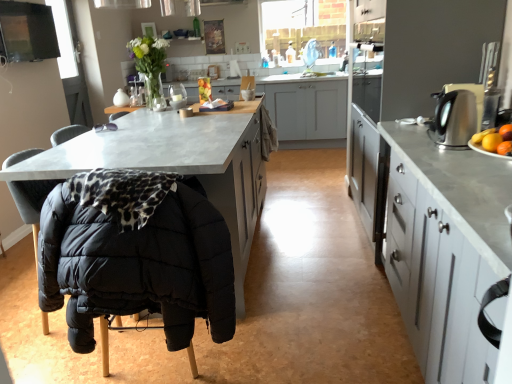
What do you see at coordinates (178, 163) in the screenshot? I see `matte gray cabinet at center, arranged as the second cabinetry when viewed from the front` at bounding box center [178, 163].

You are a GUI agent. You are given a task and a screenshot of the screen. Output one action in this format:
    pyautogui.click(x=<x>, y=<y>)
    Task: Click on the concrete countertop at center, marked as the first cabinetry in a back-to-front arrangement
    This screenshot has width=512, height=384.
    Given the screenshot: What is the action you would take?
    pyautogui.click(x=308, y=111)

The width and height of the screenshot is (512, 384). What do you see at coordinates (457, 114) in the screenshot?
I see `satin silver kettle at right` at bounding box center [457, 114].

Find the location of a particular element. The height and width of the screenshot is (384, 512). satin silver kettle at right is located at coordinates (457, 114).

Where is `metallic gray cabinets at right, which ranks as the third cabinetry in back-to-front order`? This screenshot has width=512, height=384. metallic gray cabinets at right, which ranks as the third cabinetry in back-to-front order is located at coordinates (461, 189).

Describe the element at coordinates (461, 189) in the screenshot. I see `metallic gray cabinets at right, which ranks as the third cabinetry in back-to-front order` at that location.

Where is `matte gray cabinet at center, arranged as the second cabinetry when viewed from the front`? The image size is (512, 384). matte gray cabinet at center, arranged as the second cabinetry when viewed from the front is located at coordinates click(178, 163).

Is concrete countertop at center, marked as the first cabinetry in a back-to-front arrangement, at the right side of black quilted fabric folding chair at lower left?

Yes.

Considering the positions of objects concrete countertop at center, the 3th cabinetry when ordered from front to back, and black quilted fabric folding chair at lower left in the image provided, who is in front, concrete countertop at center, the 3th cabinetry when ordered from front to back, or black quilted fabric folding chair at lower left?

black quilted fabric folding chair at lower left is in front.

Is point (375, 109) behind point (170, 278)?

Yes, it is.

From a real-world perspective, which is physically above, concrete countertop at center, marked as the first cabinetry in a back-to-front arrangement, or black quilted fabric folding chair at lower left?

black quilted fabric folding chair at lower left.

Which point is more forward, (x=462, y=118) or (x=82, y=221)?

The point (x=82, y=221) is closer.

Is black quilted fabric folding chair at lower left inside satin silver kettle at right?

No.

Is satin silver kettle at right taller than black quilted fabric folding chair at lower left?

In fact, satin silver kettle at right may be shorter than black quilted fabric folding chair at lower left.

Is metallic gray cabinets at right, which is counted as the 1th cabinetry, starting from the front, located within black quilted fabric folding chair at lower left?

No, metallic gray cabinets at right, which is counted as the 1th cabinetry, starting from the front, is not inside black quilted fabric folding chair at lower left.

Can you tell me how much black quilted fabric folding chair at lower left and metallic gray cabinets at right, which is counted as the 1th cabinetry, starting from the front, differ in facing direction?

88.6 degrees separate the facing orientations of black quilted fabric folding chair at lower left and metallic gray cabinets at right, which is counted as the 1th cabinetry, starting from the front.

Based on the photo, considering the relative positions of black quilted fabric folding chair at lower left and metallic gray cabinets at right, which ranks as the third cabinetry in back-to-front order, in the image provided, is black quilted fabric folding chair at lower left to the left of metallic gray cabinets at right, which ranks as the third cabinetry in back-to-front order, from the viewer's perspective?

Correct, you'll find black quilted fabric folding chair at lower left to the left of metallic gray cabinets at right, which ranks as the third cabinetry in back-to-front order.

Between point (233, 335) and point (474, 186), which one is positioned behind?

The point (233, 335) is behind.

From a real-world perspective, is concrete countertop at center, the 3th cabinetry when ordered from front to back, on satin silver kettle at right?

Incorrect, from a real-world perspective, concrete countertop at center, the 3th cabinetry when ordered from front to back, is lower than satin silver kettle at right.

Could you tell me if concrete countertop at center, marked as the first cabinetry in a back-to-front arrangement, is turned towards satin silver kettle at right?

Yes, concrete countertop at center, marked as the first cabinetry in a back-to-front arrangement, is oriented towards satin silver kettle at right.

Which object is closer to the camera, concrete countertop at center, marked as the first cabinetry in a back-to-front arrangement, or satin silver kettle at right?

satin silver kettle at right is in front.

Considering the sizes of objects concrete countertop at center, the 3th cabinetry when ordered from front to back, and satin silver kettle at right in the image provided, who is shorter, concrete countertop at center, the 3th cabinetry when ordered from front to back, or satin silver kettle at right?

Standing shorter between the two is satin silver kettle at right.

Is satin silver kettle at right completely or partially outside of metallic gray cabinets at right, which is counted as the 1th cabinetry, starting from the front?

Yes, satin silver kettle at right is not within metallic gray cabinets at right, which is counted as the 1th cabinetry, starting from the front.

Considering the positions of points (452, 99) and (490, 225), is point (452, 99) closer to camera compared to point (490, 225)?

No, it is not.

How different are the orientations of satin silver kettle at right and metallic gray cabinets at right, which ranks as the third cabinetry in back-to-front order, in degrees?

The angle between the facing direction of satin silver kettle at right and the facing direction of metallic gray cabinets at right, which ranks as the third cabinetry in back-to-front order, is 45.5 degrees.

Based on the photo, is the position of satin silver kettle at right less distant than that of metallic gray cabinets at right, which ranks as the third cabinetry in back-to-front order?

No, satin silver kettle at right is further to the viewer.

Based on the photo, considering the sizes of black quilted fabric folding chair at lower left and satin silver kettle at right in the image, is black quilted fabric folding chair at lower left wider or thinner than satin silver kettle at right?

Clearly, black quilted fabric folding chair at lower left has more width compared to satin silver kettle at right.

Between black quilted fabric folding chair at lower left and satin silver kettle at right, which one has smaller size?

satin silver kettle at right is smaller.

Choose the correct answer: Is black quilted fabric folding chair at lower left inside satin silver kettle at right or outside it?

black quilted fabric folding chair at lower left cannot be found inside satin silver kettle at right.

From a real-world perspective, is black quilted fabric folding chair at lower left physically above satin silver kettle at right?

No, from a real-world perspective, black quilted fabric folding chair at lower left is not on top of satin silver kettle at right.

Is there a large distance between satin silver kettle at right and matte gray cabinet at center, the second cabinetry in the back-to-front sequence?

Yes, satin silver kettle at right and matte gray cabinet at center, the second cabinetry in the back-to-front sequence, are located far from each other.

From a real-world perspective, is satin silver kettle at right beneath matte gray cabinet at center, the second cabinetry in the back-to-front sequence?

No, from a real-world perspective, satin silver kettle at right is not under matte gray cabinet at center, the second cabinetry in the back-to-front sequence.

The image size is (512, 384). In order to click on the 2nd cabinetry to the left of the satin silver kettle at right, counting from the anchor's position in this screenshot , I will do `click(178, 163)`.

Between satin silver kettle at right and matte gray cabinet at center, arranged as the second cabinetry when viewed from the front, which one has less height?

satin silver kettle at right.

Find the location of a particular element. folding chair in front of the concrete countertop at center, the 3th cabinetry when ordered from front to back is located at coordinates (138, 264).

Where is `kitchen appliance lying on the right of black quilted fabric folding chair at lower left`? kitchen appliance lying on the right of black quilted fabric folding chair at lower left is located at coordinates point(457,114).

Estimate the real-world distances between objects in this image. Which object is closer to satin silver kettle at right, metallic gray cabinets at right, which ranks as the third cabinetry in back-to-front order, or black quilted fabric folding chair at lower left?

metallic gray cabinets at right, which ranks as the third cabinetry in back-to-front order.

Looking at the image, which one is located closer to concrete countertop at center, marked as the first cabinetry in a back-to-front arrangement, matte gray cabinet at center, the second cabinetry in the back-to-front sequence, or satin silver kettle at right?

matte gray cabinet at center, the second cabinetry in the back-to-front sequence, is closer to concrete countertop at center, marked as the first cabinetry in a back-to-front arrangement.

Based on their spatial positions, is metallic gray cabinets at right, which is counted as the 1th cabinetry, starting from the front, or concrete countertop at center, marked as the first cabinetry in a back-to-front arrangement, closer to black quilted fabric folding chair at lower left?

metallic gray cabinets at right, which is counted as the 1th cabinetry, starting from the front, lies closer to black quilted fabric folding chair at lower left than the other object.

Based on their spatial positions, is concrete countertop at center, marked as the first cabinetry in a back-to-front arrangement, or black quilted fabric folding chair at lower left further from satin silver kettle at right?

concrete countertop at center, marked as the first cabinetry in a back-to-front arrangement.

Consider the image. When comparing their distances from concrete countertop at center, marked as the first cabinetry in a back-to-front arrangement, does metallic gray cabinets at right, which is counted as the 1th cabinetry, starting from the front, or satin silver kettle at right seem further?

metallic gray cabinets at right, which is counted as the 1th cabinetry, starting from the front, is further to concrete countertop at center, marked as the first cabinetry in a back-to-front arrangement.

Considering their positions, is concrete countertop at center, marked as the first cabinetry in a back-to-front arrangement, positioned further to metallic gray cabinets at right, which is counted as the 1th cabinetry, starting from the front, than satin silver kettle at right?

concrete countertop at center, marked as the first cabinetry in a back-to-front arrangement, lies further to metallic gray cabinets at right, which is counted as the 1th cabinetry, starting from the front, than the other object.

Looking at the image, which one is located further to black quilted fabric folding chair at lower left, satin silver kettle at right or concrete countertop at center, the 3th cabinetry when ordered from front to back?

concrete countertop at center, the 3th cabinetry when ordered from front to back.

Based on their spatial positions, is concrete countertop at center, the 3th cabinetry when ordered from front to back, or metallic gray cabinets at right, which ranks as the third cabinetry in back-to-front order, closer to satin silver kettle at right?

metallic gray cabinets at right, which ranks as the third cabinetry in back-to-front order, lies closer to satin silver kettle at right than the other object.

The height and width of the screenshot is (384, 512). Find the location of `folding chair between matte gray cabinet at center, the second cabinetry in the back-to-front sequence, and satin silver kettle at right from left to right`. folding chair between matte gray cabinet at center, the second cabinetry in the back-to-front sequence, and satin silver kettle at right from left to right is located at coordinates (138, 264).

At what (x,y) coordinates should I click in order to perform the action: click on folding chair between matte gray cabinet at center, the second cabinetry in the back-to-front sequence, and metallic gray cabinets at right, which is counted as the 1th cabinetry, starting from the front, from left to right. Please return your answer as a coordinate pair (x, y). This screenshot has width=512, height=384. Looking at the image, I should click on (138, 264).

The width and height of the screenshot is (512, 384). In order to click on kitchen appliance located between black quilted fabric folding chair at lower left and concrete countertop at center, the 3th cabinetry when ordered from front to back, in the depth direction in this screenshot , I will do click(x=457, y=114).

This screenshot has height=384, width=512. What are the coordinates of `kitchen appliance positioned between metallic gray cabinets at right, which is counted as the 1th cabinetry, starting from the front, and concrete countertop at center, the 3th cabinetry when ordered from front to back, from near to far` in the screenshot? It's located at (457, 114).